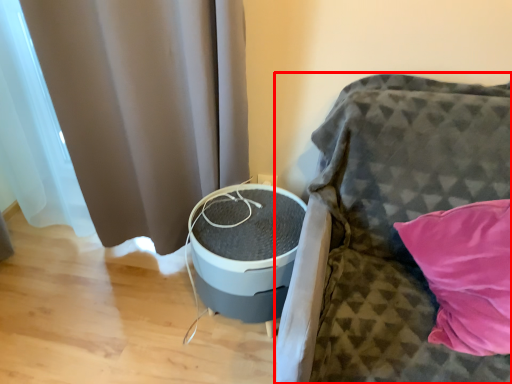
Question: Considering the relative positions of furniture (annotated by the red box) and curtain in the image provided, where is furniture (annotated by the red box) located with respect to the staircase?

Choices:
 (A) right
 (B) left

Answer: (A)